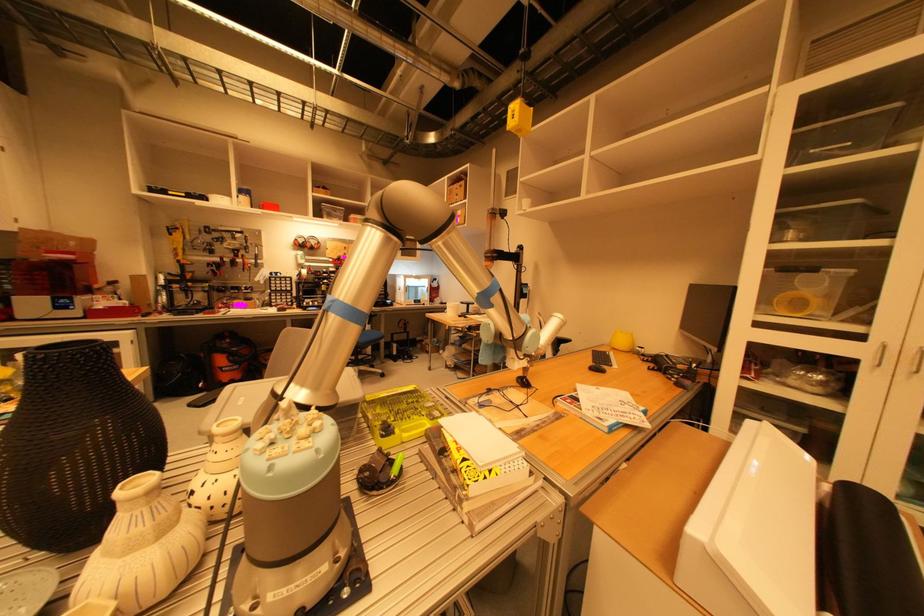
Where would you sit the blue chair sitting surface? Please return your answer as a coordinate pair (x, y).

(369, 338)